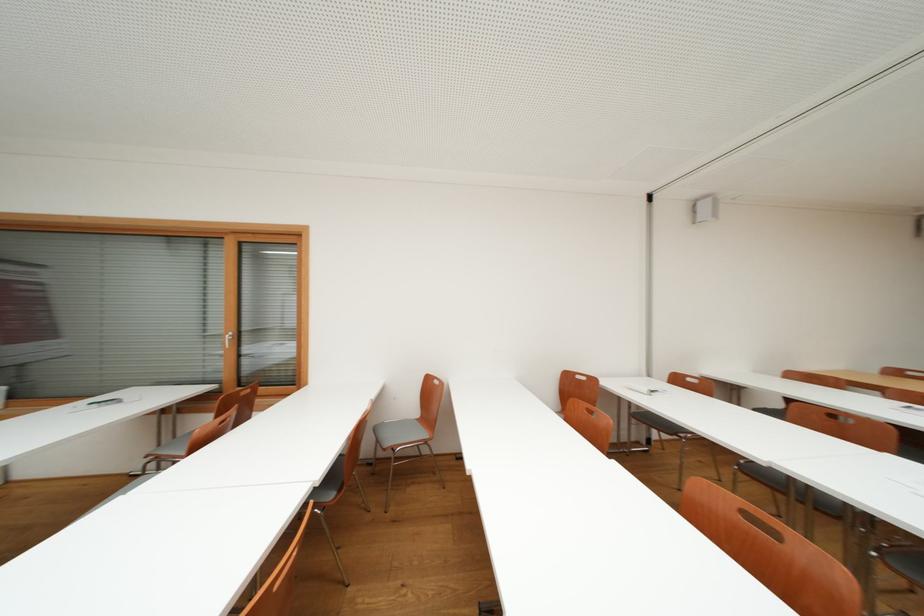
Where is `silver window handle`? The height and width of the screenshot is (616, 924). silver window handle is located at coordinates (227, 339).